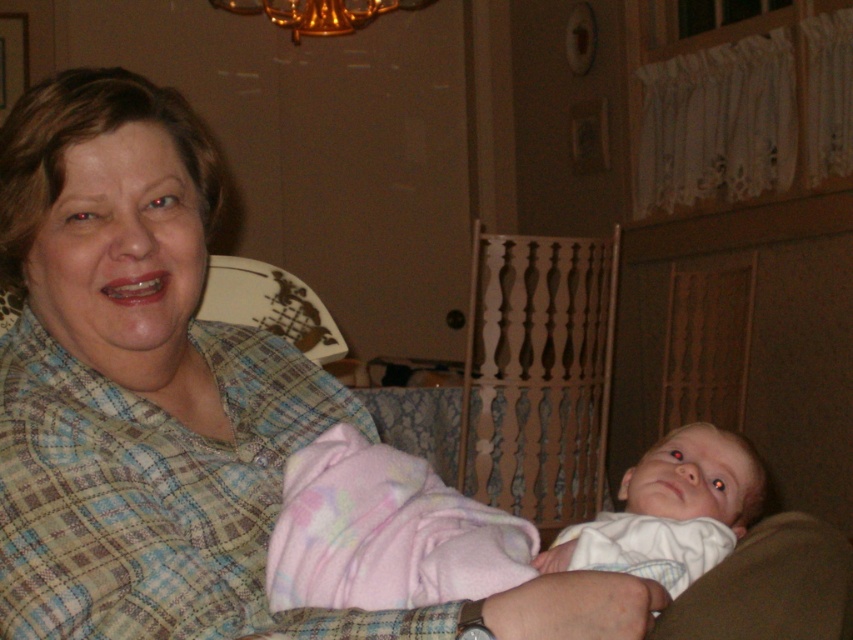
How distant is plaid fabric at center from wooden at center?

plaid fabric at center is 7.03 feet away from wooden at center.

Does plaid fabric at center lie in front of wooden at center?

Yes, it is.

Which is behind, point (76, 531) or point (490, 321)?

The point (490, 321) is more distant.

The width and height of the screenshot is (853, 640). In order to click on plaid fabric at center in this screenshot , I will do `click(170, 403)`.

In the scene shown: Who is taller, plaid fabric at center or white cotton baby at center?

plaid fabric at center

Is the position of plaid fabric at center less distant than that of white cotton baby at center?

Yes, plaid fabric at center is in front of white cotton baby at center.

Is point (244, 422) positioned behind point (621, 480)?

That is False.

You are a GUI agent. You are given a task and a screenshot of the screen. Output one action in this format:
    pyautogui.click(x=<x>, y=<y>)
    Task: Click on the plaid fabric at center
    The width and height of the screenshot is (853, 640).
    Given the screenshot: What is the action you would take?
    pyautogui.click(x=170, y=403)

Is wooden at center bigger than white cotton baby at center?

Indeed, wooden at center has a larger size compared to white cotton baby at center.

Is wooden at center taller than white cotton baby at center?

Yes, wooden at center is taller than white cotton baby at center.

Between point (543, 420) and point (589, 532), which one is positioned behind?

Point (543, 420)

Locate an element on the screen. The width and height of the screenshot is (853, 640). wooden at center is located at coordinates (538, 374).